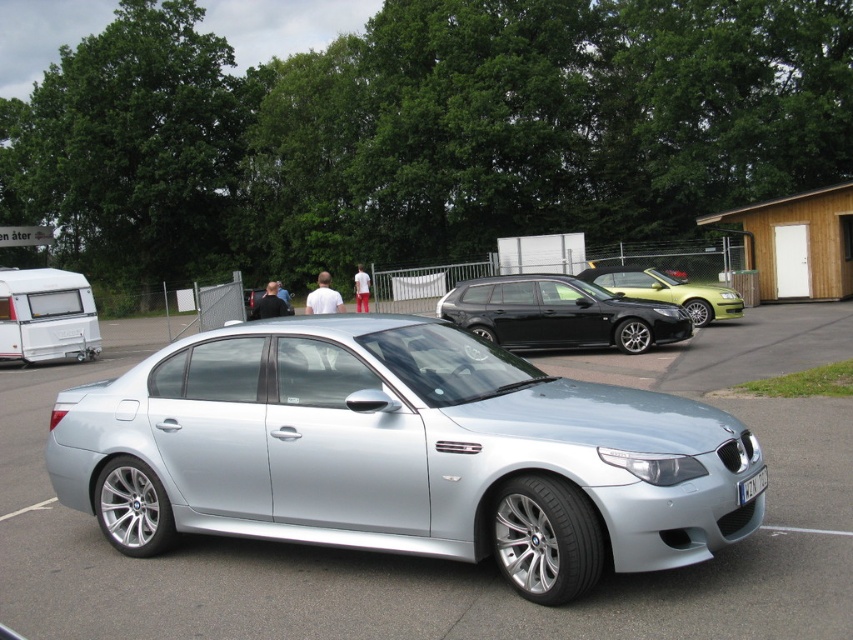
In the scene shown: You are a delivery person trying to park your van in the parking lot. You see the metallic green car at center and the white plastic license plate at center. Which object is closer to you?

The metallic green car at center is closer to you because it is positioned over the white plastic license plate at center, indicating it is in front.

Based on the photo, you are a delivery person trying to park your van between the metallic green car at center and the white plastic license plate at center. Can your van fit between them if your van is 2 meters wide?

The metallic green car at center is wider than the white plastic license plate at center. However, since the exact distance between them isn t provided, we cannot determine if the van will fit. Please check the actual space available.

You are a delivery person who needs to park a 6.5 feet tall delivery van. You see the satin silver car at center and the white matte camper at left. Which parking spot between them can accommodate your van?

The white matte camper at left is taller than the satin silver car at center. Since the delivery van is 6.5 feet tall, you should choose the parking spot near the satin silver car at center because it is shorter and less likely to obstruct the van.